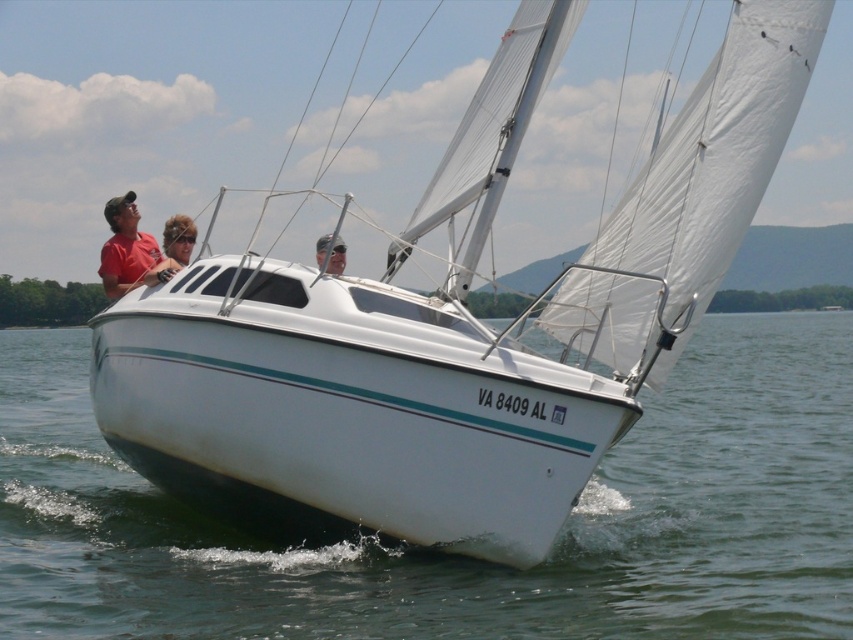
You are a photographer taking a picture of the two people at the center of the boat. You want to ensure that both the blonde hair at center and the matte pink hair at center are clearly visible in the photo. Which person should you focus on first to ensure their hair is in focus?

The blonde hair at center is taller than matte pink hair at center, so you should focus on the blonde hair at center first to ensure both are in focus.

From the picture: You are standing on the deck of the sailboat and notice the registration VA 8409 AL near the bow. Where is the matte red shirt at upper left located relative to the registration? Please provide coordinates in the format of a point like this example format of point coordinates in the image. For example, if the registration is at point A and the shirt is at point B, then the answer would be the coordinates of point B relative to A. The registration is at point with coordinates of point registration is at the

The registration VA 8409 AL is at point with coordinates of point registration is at the bow of the boat. The matte red shirt at upper left is located at point coordinates of point registration is at the bow of the boat. The matte red shirt at upper left is located at point coordinates of point registration is at the bow of the boat. The matte red shirt at upper left is located at point coordinates of point registration is at the bow of the boat. The matte red shirt at upper left is located at point 0.392,

You are a photographer standing on the dock, and you want to take a photo of the matte red shirt at upper left and the matte pink hair at center in the same frame. The camera you have can capture objects up to 2.5 meters apart in the same shot. Will both subjects fit in your camera frame?

The matte red shirt at upper left and matte pink hair at center are 2.63 meters apart, which exceeds the camera frame limit of 2.5 meters. Therefore, both subjects cannot fit in the same frame.